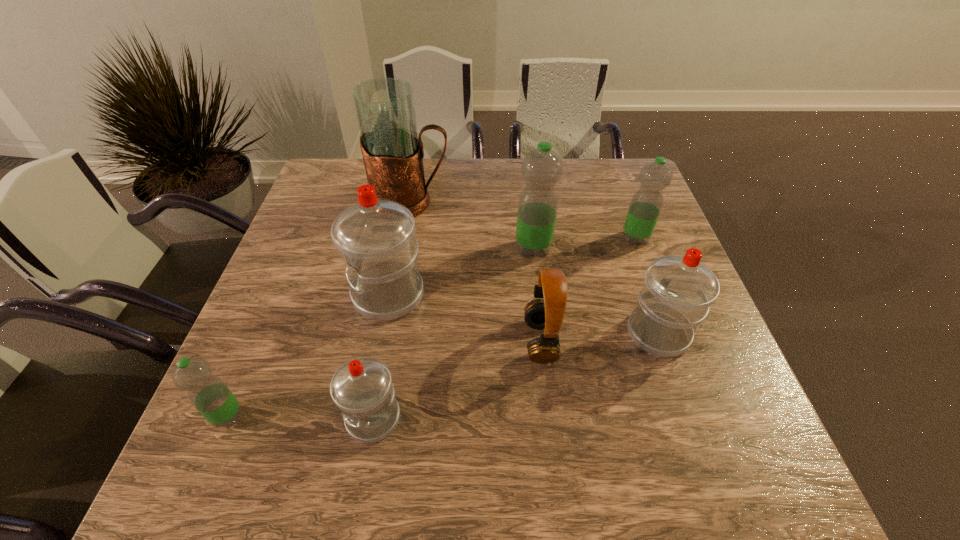
At what (x,y) coordinates should I click in order to perform the action: click on vacant space located on the ear cups of the brown headset. Please return your answer as a coordinate pair (x, y). The width and height of the screenshot is (960, 540). Looking at the image, I should click on pyautogui.click(x=403, y=341).

What are the coordinates of `vacant space located 0.060m on the ear cups of the brown headset` in the screenshot? It's located at (x=496, y=341).

Identify the location of vacant space located 0.250m on the ear cups of the brown headset. (408, 341).

Where is `free location located on the handle side of the smallest white water bottle`? This screenshot has height=540, width=960. free location located on the handle side of the smallest white water bottle is located at coordinates (364, 474).

The width and height of the screenshot is (960, 540). What are the coordinates of `blank space located on the right of the leftmost object` in the screenshot? It's located at (360, 416).

Find the location of a particular element. This screenshot has width=960, height=540. object that is at the far edge is located at coordinates (393, 154).

Locate an element on the screen. The width and height of the screenshot is (960, 540). object located at the near edge is located at coordinates (362, 389).

The height and width of the screenshot is (540, 960). Identify the location of object at the left edge. (208, 393).

In the image, there is a desktop. Find the location of `free region at the far edge`. free region at the far edge is located at coordinates coord(448,173).

Where is `vacant space at the left edge of the desktop`? This screenshot has width=960, height=540. vacant space at the left edge of the desktop is located at coordinates (301, 277).